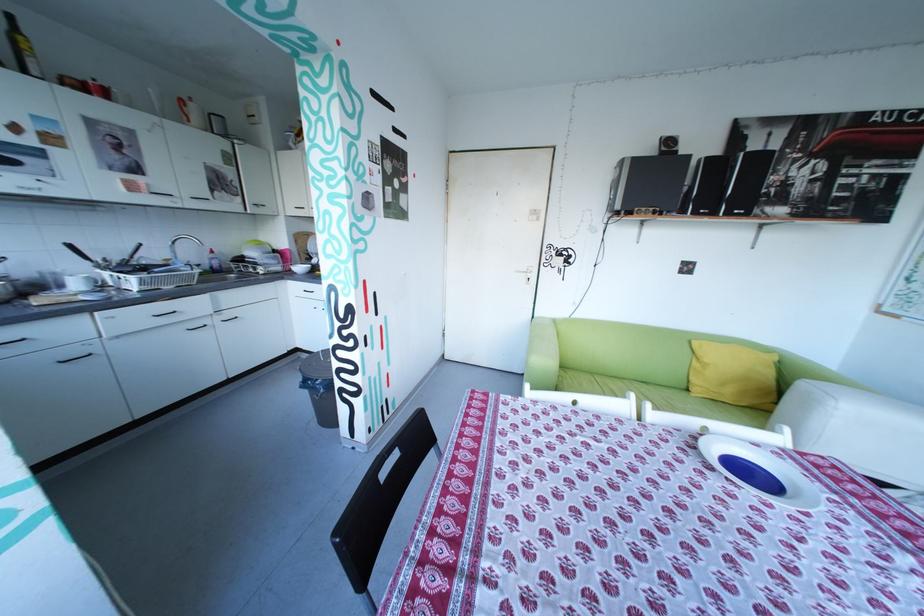
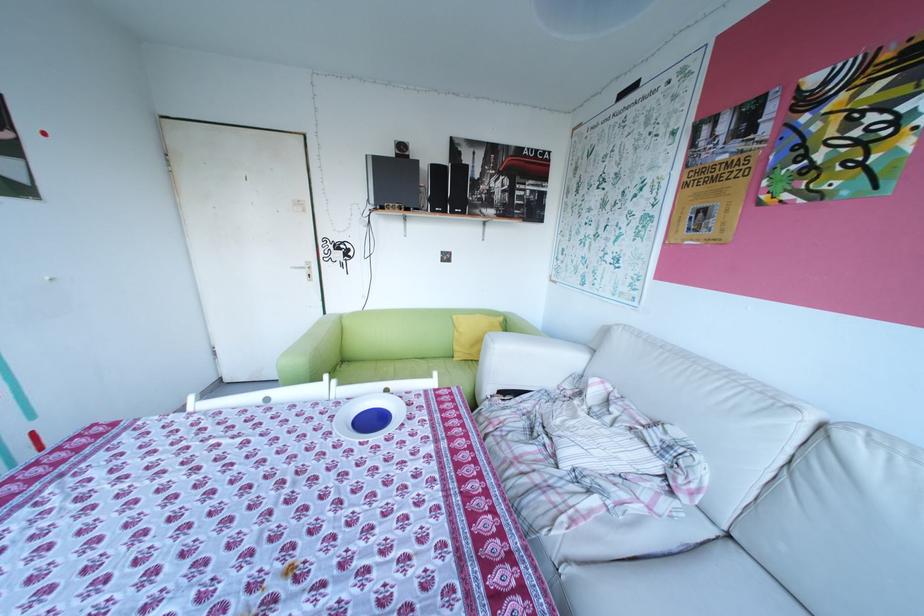
Question: The camera is either moving clockwise (left) or counter-clockwise (right) around the object. The first image is from the beginning of the video and the second image is from the end. Is the camera moving left or right when shooting the video?

Choices:
 (A) Left
 (B) Right

Answer: (A)